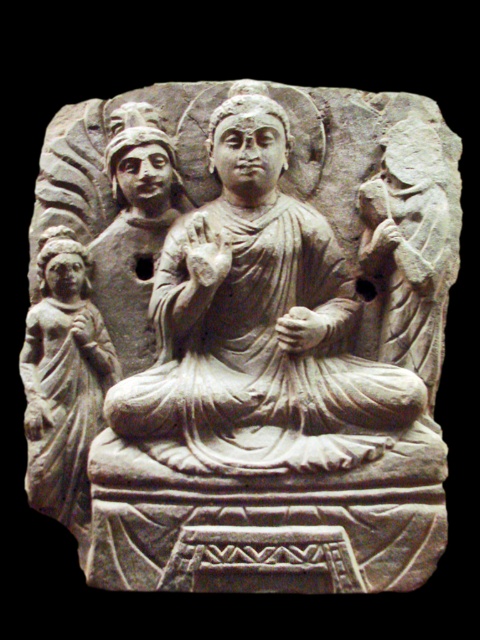
How distant is smooth stone figure at center from smooth stone figure at upper left?

smooth stone figure at center is 1.09 meters away from smooth stone figure at upper left.

Is smooth stone figure at center taller than smooth stone figure at upper left?

Yes, smooth stone figure at center is taller than smooth stone figure at upper left.

Is point (428, 368) positioned behind point (145, 192)?

No, (428, 368) is in front of (145, 192).

This screenshot has width=480, height=640. Identify the location of smooth stone figure at center. (410, 244).

Is smooth stone figure at center thinner than smooth beige statue at lower left?

No, smooth stone figure at center is not thinner than smooth beige statue at lower left.

Who is lower down, smooth stone figure at center or smooth beige statue at lower left?

Positioned lower is smooth beige statue at lower left.

What do you see at coordinates (410, 244) in the screenshot? I see `smooth stone figure at center` at bounding box center [410, 244].

The width and height of the screenshot is (480, 640). What are the coordinates of `smooth stone figure at center` in the screenshot? It's located at 410,244.

Is point (36, 320) farther from camera compared to point (139, 227)?

No, it is not.

Between smooth beige statue at lower left and smooth stone figure at upper left, which one has less height?

smooth stone figure at upper left

Image resolution: width=480 pixels, height=640 pixels. What do you see at coordinates (63, 380) in the screenshot? I see `smooth beige statue at lower left` at bounding box center [63, 380].

Find the location of `smooth beige statue at lower left`. smooth beige statue at lower left is located at coordinates (63, 380).